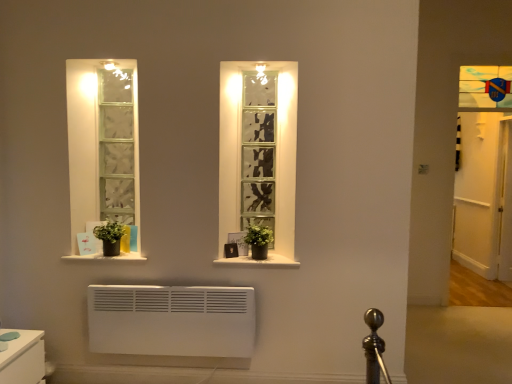
Question: Is white wooden door at right thinner than white matte window sill at lower left, which is the first window sill in left-to-right order?

Choices:
 (A) yes
 (B) no

Answer: (A)

Question: Can you confirm if white wooden door at right is smaller than white matte window sill at lower left, which ranks as the 2th window sill in right-to-left order?

Choices:
 (A) yes
 (B) no

Answer: (B)

Question: From a real-world perspective, does white wooden door at right sit lower than white matte window sill at lower left, which ranks as the 2th window sill in right-to-left order?

Choices:
 (A) yes
 (B) no

Answer: (B)

Question: Is white wooden door at right next to white matte window sill at lower left, which is the first window sill in left-to-right order, and touching it?

Choices:
 (A) no
 (B) yes

Answer: (A)

Question: From a real-world perspective, is white wooden door at right positioned over white matte window sill at lower left, which ranks as the 2th window sill in right-to-left order, based on gravity?

Choices:
 (A) yes
 (B) no

Answer: (A)

Question: Is white wooden door at right outside of white matte window sill at lower left, which ranks as the 2th window sill in right-to-left order?

Choices:
 (A) no
 (B) yes

Answer: (B)

Question: Is white matte window sill at lower left, which ranks as the 2th window sill in right-to-left order, smaller than green matte plant at lower left, positioned as the 2th plant in right-to-left order?

Choices:
 (A) yes
 (B) no

Answer: (B)

Question: From the image's perspective, would you say white matte window sill at lower left, which is the first window sill in left-to-right order, is positioned over green matte plant at lower left, which ranks as the first plant in left-to-right order?

Choices:
 (A) yes
 (B) no

Answer: (B)

Question: Considering the relative sizes of white matte window sill at lower left, which is the first window sill in left-to-right order, and green matte plant at lower left, positioned as the 2th plant in right-to-left order, in the image provided, is white matte window sill at lower left, which is the first window sill in left-to-right order, taller than green matte plant at lower left, positioned as the 2th plant in right-to-left order,?

Choices:
 (A) yes
 (B) no

Answer: (B)

Question: Is white matte window sill at lower left, which ranks as the 2th window sill in right-to-left order, not close to green matte plant at lower left, positioned as the 2th plant in right-to-left order?

Choices:
 (A) yes
 (B) no

Answer: (B)

Question: From a real-world perspective, is white matte window sill at lower left, which is the first window sill in left-to-right order, on green matte plant at lower left, positioned as the 2th plant in right-to-left order?

Choices:
 (A) yes
 (B) no

Answer: (B)

Question: Is white matte window sill at lower left, which ranks as the 2th window sill in right-to-left order, thinner than green matte plant at lower left, which ranks as the first plant in left-to-right order?

Choices:
 (A) no
 (B) yes

Answer: (A)

Question: Is black matte window sill at center, the 1th window sill when ordered from right to left, smaller than white wooden door at right?

Choices:
 (A) yes
 (B) no

Answer: (A)